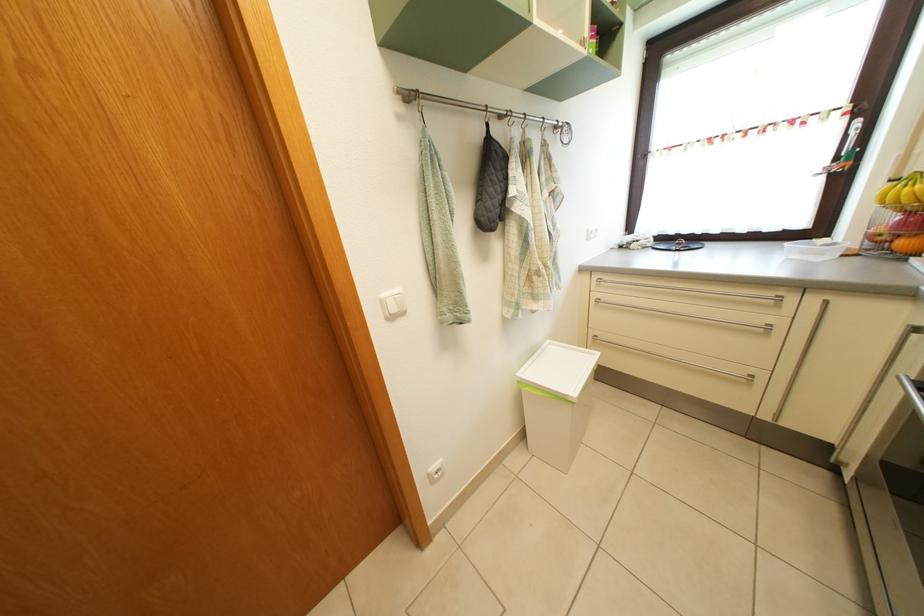
What are the coordinates of `window handle` in the screenshot? It's located at (852, 138).